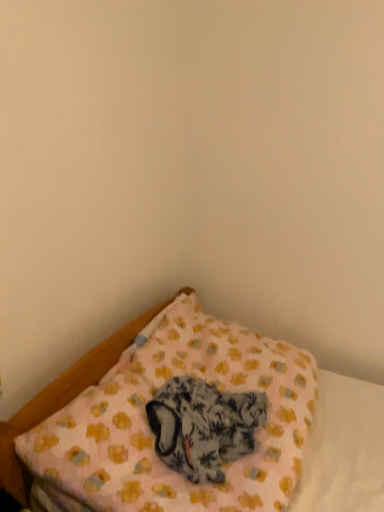
What do you see at coordinates (154, 435) in the screenshot? I see `pink fabric pillow at lower center` at bounding box center [154, 435].

Locate an element on the screen. The width and height of the screenshot is (384, 512). pink fabric pillow at lower center is located at coordinates (154, 435).

What is the approximate height of pink fabric pillow at lower center?

pink fabric pillow at lower center is 24.41 centimeters tall.

This screenshot has height=512, width=384. What do you see at coordinates (203, 426) in the screenshot? I see `fluffy fabric cat at lower center` at bounding box center [203, 426].

At what (x,y) coordinates should I click in order to perform the action: click on fluffy fabric cat at lower center. Please return your answer as a coordinate pair (x, y). This screenshot has width=384, height=512. Looking at the image, I should click on pos(203,426).

This screenshot has width=384, height=512. Identify the location of pink fabric pillow at lower center. (x=154, y=435).

Can you confirm if fluffy fabric cat at lower center is positioned to the left of pink fabric pillow at lower center?

Yes.

Which object is closer to the camera, fluffy fabric cat at lower center or pink fabric pillow at lower center?

pink fabric pillow at lower center is in front.

Which point is more distant from viewer, (185,384) or (229,362)?

Point (229,362)

From the image's perspective, between fluffy fabric cat at lower center and pink fabric pillow at lower center, which one is located above?

From the image's view, pink fabric pillow at lower center is above.

From a real-world perspective, which object stands above the other?

In real-world perspective, fluffy fabric cat at lower center is above.

Which object is wider, fluffy fabric cat at lower center or pink fabric pillow at lower center?

pink fabric pillow at lower center is wider.

From their relative heights in the image, would you say fluffy fabric cat at lower center is taller or shorter than pink fabric pillow at lower center?

fluffy fabric cat at lower center is shorter than pink fabric pillow at lower center.

Can you confirm if fluffy fabric cat at lower center is bigger than pink fabric pillow at lower center?

No.

From the picture: Is fluffy fabric cat at lower center completely or partially outside of pink fabric pillow at lower center?

No.

Based on the photo, is fluffy fabric cat at lower center positioned far away from pink fabric pillow at lower center?

fluffy fabric cat at lower center is actually quite close to pink fabric pillow at lower center.

Looking at this image, is pink fabric pillow at lower center at the back of fluffy fabric cat at lower center?

Yes.

What's the angular difference between fluffy fabric cat at lower center and pink fabric pillow at lower center's facing directions?

6.43 degrees separate the facing orientations of fluffy fabric cat at lower center and pink fabric pillow at lower center.

Locate an element on the screen. bed that is above the fluffy fabric cat at lower center (from the image's perspective) is located at coordinates (154, 435).

Considering the relative positions of pink fabric pillow at lower center and fluffy fabric cat at lower center in the image provided, is pink fabric pillow at lower center to the right of fluffy fabric cat at lower center from the viewer's perspective?

Yes.

Which object is closer to the camera taking this photo, pink fabric pillow at lower center or fluffy fabric cat at lower center?

pink fabric pillow at lower center is closer to the camera.

Which is in front, point (199, 334) or point (193, 398)?

Point (193, 398)

From the image's perspective, which is above, pink fabric pillow at lower center or fluffy fabric cat at lower center?

pink fabric pillow at lower center is shown above in the image.

From a real-world perspective, relative to fluffy fabric cat at lower center, is pink fabric pillow at lower center vertically above or below?

Clearly, from a real-world perspective, pink fabric pillow at lower center is below fluffy fabric cat at lower center.

Is pink fabric pillow at lower center thinner than fluffy fabric cat at lower center?

Incorrect, the width of pink fabric pillow at lower center is not less than that of fluffy fabric cat at lower center.

Which of these two, pink fabric pillow at lower center or fluffy fabric cat at lower center, stands taller?

pink fabric pillow at lower center.

Can you confirm if pink fabric pillow at lower center is bigger than fluffy fabric cat at lower center?

Indeed, pink fabric pillow at lower center has a larger size compared to fluffy fabric cat at lower center.

Is pink fabric pillow at lower center spatially inside fluffy fabric cat at lower center, or outside of it?

pink fabric pillow at lower center is not enclosed by fluffy fabric cat at lower center.

Is pink fabric pillow at lower center positioned far away from fluffy fabric cat at lower center?

They are positioned close to each other.

Does pink fabric pillow at lower center turn towards fluffy fabric cat at lower center?

Yes.

Can you tell me how much pink fabric pillow at lower center and fluffy fabric cat at lower center differ in facing direction?

6.43 degrees separate the facing orientations of pink fabric pillow at lower center and fluffy fabric cat at lower center.

Find the location of a particular element. bed below the fluffy fabric cat at lower center (from a real-world perspective) is located at coordinates (154, 435).

The height and width of the screenshot is (512, 384). I want to click on animal located on the left of pink fabric pillow at lower center, so click(203, 426).

Find the location of `bed above the fluffy fabric cat at lower center (from the image's perspective)`. bed above the fluffy fabric cat at lower center (from the image's perspective) is located at coordinates (154, 435).